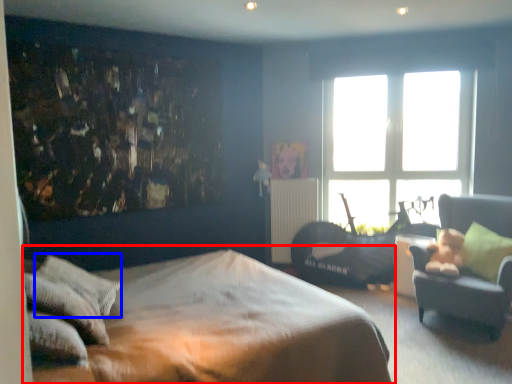
Question: Which point is further to the camera, bed (highlighted by a red box) or pillow (highlighted by a blue box)?

Choices:
 (A) bed
 (B) pillow

Answer: (B)